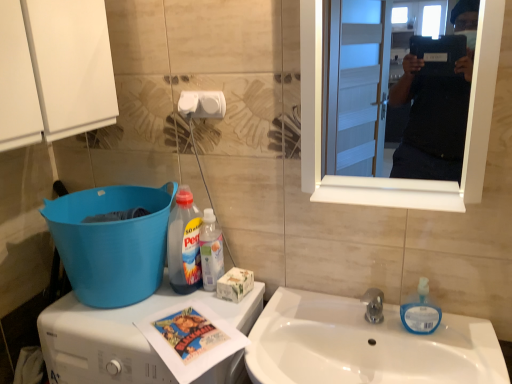
Identify the location of free location in front of translucent plastic detergent at lower left, positioned as the first bottle in left-to-right order. (183, 307).